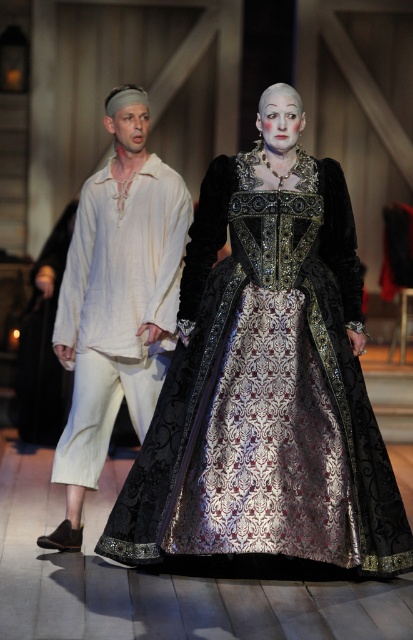
Question: Does silvery brocade dress at center appear on the right side of light beige linen shirt at left?

Choices:
 (A) yes
 (B) no

Answer: (A)

Question: Which point is farther from the camera taking this photo?

Choices:
 (A) (137, 348)
 (B) (400, 522)

Answer: (A)

Question: Which point appears farthest from the camera in this image?

Choices:
 (A) (289, 248)
 (B) (106, 285)

Answer: (B)

Question: Among these objects, which one is farthest from the camera?

Choices:
 (A) silvery brocade dress at center
 (B) light beige linen shirt at left

Answer: (B)

Question: Is silvery brocade dress at center below light beige linen shirt at left?

Choices:
 (A) yes
 (B) no

Answer: (A)

Question: Is silvery brocade dress at center positioned at the back of light beige linen shirt at left?

Choices:
 (A) yes
 (B) no

Answer: (B)